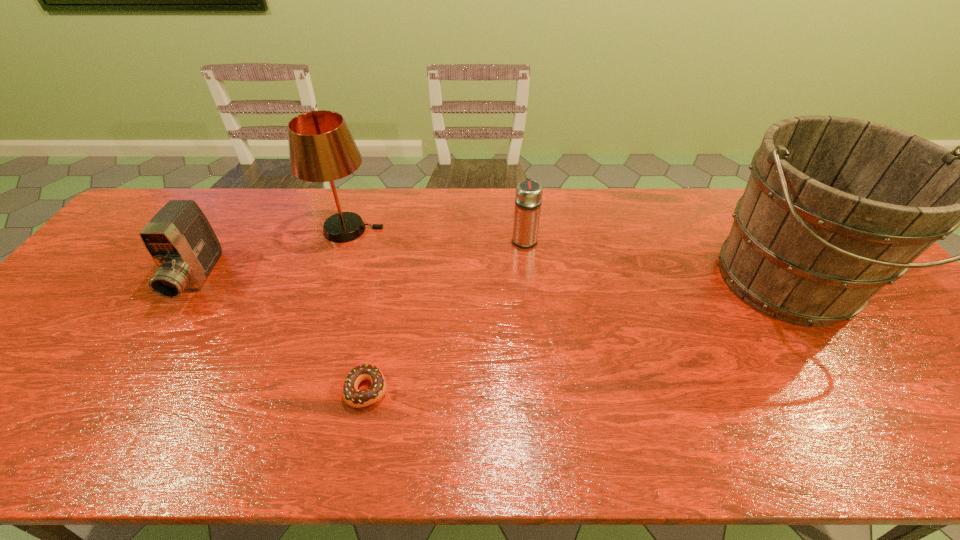
The width and height of the screenshot is (960, 540). Identify the location of vacant region between the thermos bottle and the fourth object from right to left. (437, 234).

You are a GUI agent. You are given a task and a screenshot of the screen. Output one action in this format:
    pyautogui.click(x=<x>, y=<y>)
    Task: Click on the free spot between the lampshade and the bucket
    Image resolution: width=960 pixels, height=540 pixels.
    Given the screenshot: What is the action you would take?
    pyautogui.click(x=568, y=256)

This screenshot has height=540, width=960. I want to click on free area in between the shortest object and the thermos bottle, so click(445, 314).

Image resolution: width=960 pixels, height=540 pixels. I want to click on the fourth closest object relative to the fourth object from right to left, so click(835, 208).

I want to click on object that is the fourth closest to the nearest object, so click(x=835, y=208).

Locate an element on the screen. This screenshot has height=540, width=960. free location that satisfies the following two spatial constraints: 1. on the front-facing side of the second object from left to right; 2. on the left side of the nearest object is located at coordinates (295, 390).

The width and height of the screenshot is (960, 540). Find the location of `blank space that satisfies the following two spatial constraints: 1. with a handle on the side of the thermos bottle; 2. on the front-facing side of the lampshade`. blank space that satisfies the following two spatial constraints: 1. with a handle on the side of the thermos bottle; 2. on the front-facing side of the lampshade is located at coordinates (523, 230).

The height and width of the screenshot is (540, 960). Find the location of `vacant area in the image that satisfies the following two spatial constraints: 1. on the back side of the nearest object; 2. on the front-facing side of the second object from left to right`. vacant area in the image that satisfies the following two spatial constraints: 1. on the back side of the nearest object; 2. on the front-facing side of the second object from left to right is located at coordinates (399, 230).

Find the location of a particular element. This screenshot has height=540, width=960. vacant area in the image that satisfies the following two spatial constraints: 1. on the back side of the nearest object; 2. on the front-facing side of the fourth object from right to left is located at coordinates (399, 230).

This screenshot has height=540, width=960. Find the location of `vacant space that satisfies the following two spatial constraints: 1. with a handle on the side of the fourth object from left to right; 2. on the front-facing side of the lampshade`. vacant space that satisfies the following two spatial constraints: 1. with a handle on the side of the fourth object from left to right; 2. on the front-facing side of the lampshade is located at coordinates (523, 230).